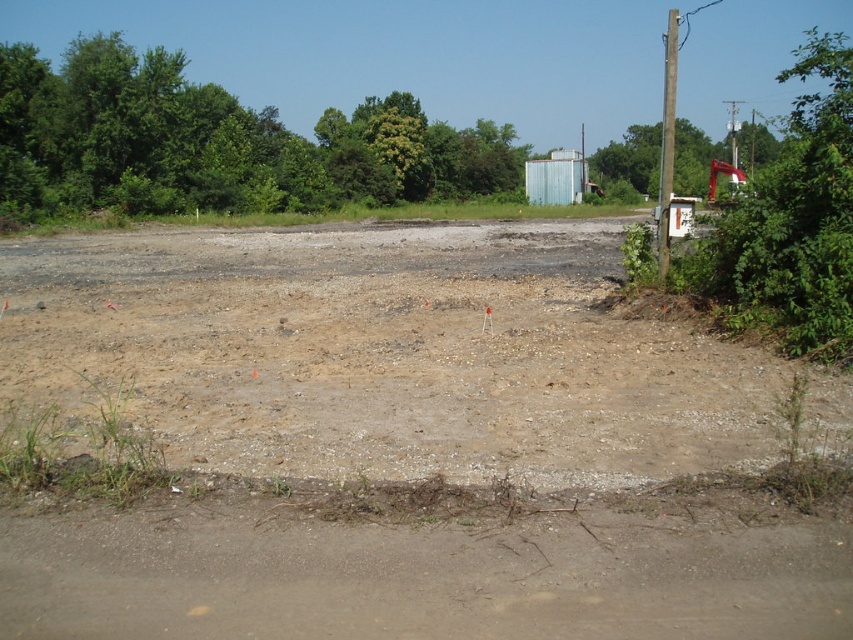
You are standing at the edge of a construction site and see two points marked on the ground. The first point is at coordinate point (62, 284) and the second is at coordinate point (743, 134). If you are facing the direction of the construction site, which point would you see first as you look towards the site?

Point (62, 284) is in front of point (743, 134), so you would see point (62, 284) first as you look towards the construction site.